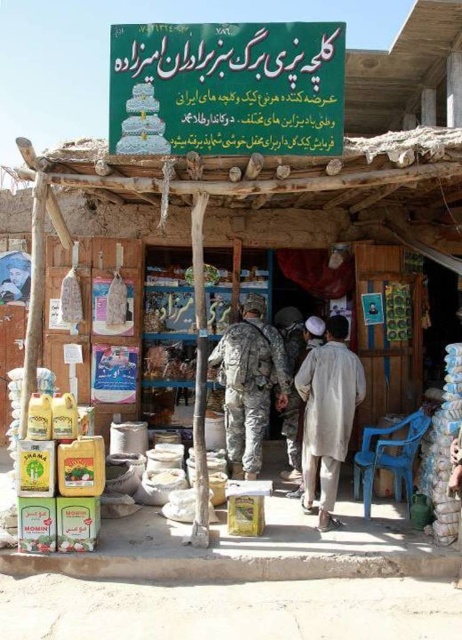
Does matte plastic signboard at upper center have a lesser height compared to camouflage fabric uniform at center?

Indeed, matte plastic signboard at upper center has a lesser height compared to camouflage fabric uniform at center.

Is point (224, 138) positioned behind point (243, 397)?

No, (224, 138) is in front of (243, 397).

Between point (133, 64) and point (248, 396), which one is positioned in front?

Positioned in front is point (133, 64).

What are the coordinates of `matte plastic signboard at upper center` in the screenshot? It's located at (228, 88).

Is light beige fabric at center above camouflage fabric uniform at center?

Incorrect, light beige fabric at center is not positioned above camouflage fabric uniform at center.

Between point (340, 420) and point (259, 444), which one is positioned in front?

Point (340, 420) is more forward.

Which is behind, point (323, 433) or point (243, 304)?

Point (243, 304)

The height and width of the screenshot is (640, 462). I want to click on light beige fabric at center, so click(328, 416).

Is matte plastic signboard at upper center smaller than light beige fabric at center?

Actually, matte plastic signboard at upper center might be larger than light beige fabric at center.

Is matte plastic signboard at upper center wider than light beige fabric at center?

Yes.

Is point (273, 132) farther from camera compared to point (338, 440)?

That is False.

The height and width of the screenshot is (640, 462). What are the coordinates of `matte plastic signboard at upper center` in the screenshot? It's located at (228, 88).